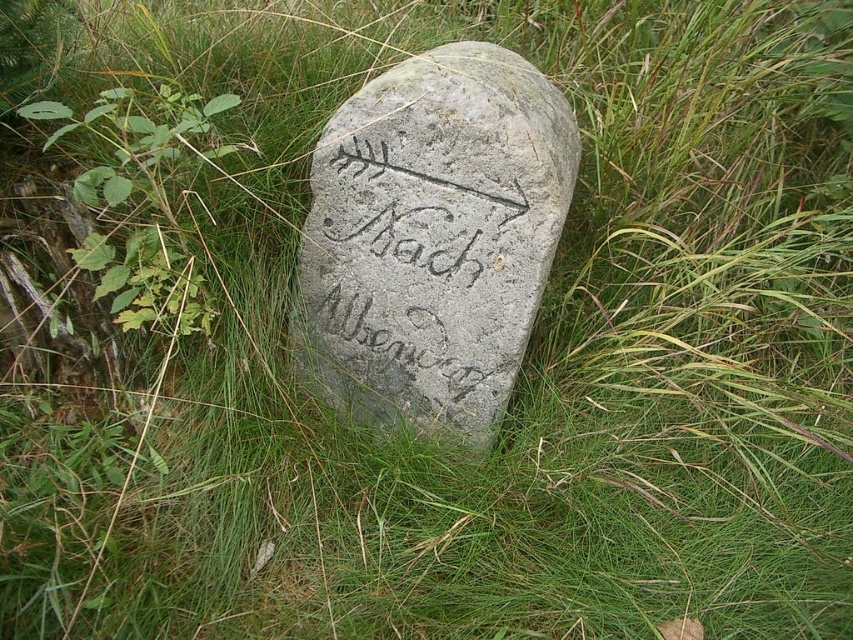
Question: Is gray stone marker at center to the left of green leafy plant at left from the viewer's perspective?

Choices:
 (A) yes
 (B) no

Answer: (B)

Question: Does gray stone marker at center have a lesser width compared to green leafy plant at left?

Choices:
 (A) no
 (B) yes

Answer: (A)

Question: Observing the image, what is the correct spatial positioning of gray stone marker at center in reference to green leafy plant at left?

Choices:
 (A) below
 (B) above

Answer: (A)

Question: Which of the following is the closest to the observer?

Choices:
 (A) gray stone marker at center
 (B) green leafy plant at left

Answer: (B)

Question: Which object appears farthest from the camera in this image?

Choices:
 (A) gray stone marker at center
 (B) green leafy plant at left

Answer: (A)